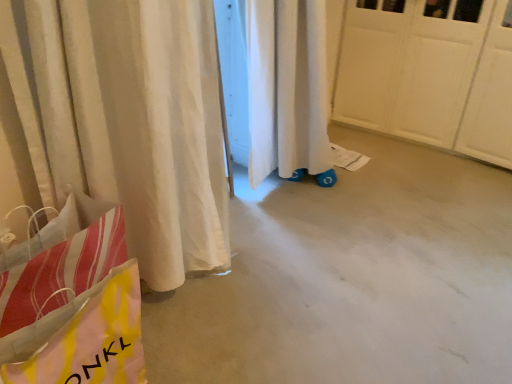
This screenshot has height=384, width=512. What do you see at coordinates (351, 279) in the screenshot?
I see `smooth concrete floor at center` at bounding box center [351, 279].

This screenshot has height=384, width=512. I want to click on smooth concrete floor at center, so (351, 279).

What is the approximate width of yellow and pink plastic bag at lower left?

yellow and pink plastic bag at lower left is 4.51 inches in width.

This screenshot has height=384, width=512. What are the coordinates of `yellow and pink plastic bag at lower left` in the screenshot? It's located at (93, 339).

Image resolution: width=512 pixels, height=384 pixels. What do you see at coordinates (93, 339) in the screenshot? I see `yellow and pink plastic bag at lower left` at bounding box center [93, 339].

Locate an element on the screen. The height and width of the screenshot is (384, 512). smooth concrete floor at center is located at coordinates (351, 279).

Which is more to the right, smooth concrete floor at center or yellow and pink plastic bag at lower left?

Positioned to the right is smooth concrete floor at center.

Is smooth concrete floor at center positioned behind yellow and pink plastic bag at lower left?

Yes, it is.

Is point (264, 227) closer or farther from the camera than point (65, 347)?

Point (264, 227).

From the image's perspective, is smooth concrete floor at center above or below yellow and pink plastic bag at lower left?

smooth concrete floor at center is above yellow and pink plastic bag at lower left.

From a real-world perspective, is smooth concrete floor at center located beneath yellow and pink plastic bag at lower left?

Yes, from a real-world perspective, smooth concrete floor at center is beneath yellow and pink plastic bag at lower left.

Looking at their sizes, would you say smooth concrete floor at center is wider or thinner than yellow and pink plastic bag at lower left?

Clearly, smooth concrete floor at center has more width compared to yellow and pink plastic bag at lower left.

Between smooth concrete floor at center and yellow and pink plastic bag at lower left, which one has less height?

Standing shorter between the two is smooth concrete floor at center.

Who is smaller, smooth concrete floor at center or yellow and pink plastic bag at lower left?

yellow and pink plastic bag at lower left is smaller.

Is smooth concrete floor at center positioned beyond the bounds of yellow and pink plastic bag at lower left?

That's correct, smooth concrete floor at center is outside of yellow and pink plastic bag at lower left.

Is the surface of smooth concrete floor at center in direct contact with yellow and pink plastic bag at lower left?

No, smooth concrete floor at center is not in contact with yellow and pink plastic bag at lower left.

Is smooth concrete floor at center facing away from yellow and pink plastic bag at lower left?

No.

How many degrees apart are the facing directions of smooth concrete floor at center and yellow and pink plastic bag at lower left?

The facing directions of smooth concrete floor at center and yellow and pink plastic bag at lower left are 88.6 degrees apart.

This screenshot has width=512, height=384. I want to click on concrete below the yellow and pink plastic bag at lower left (from a real-world perspective), so click(351, 279).

Does yellow and pink plastic bag at lower left appear on the right side of smooth concrete floor at center?

No.

Is yellow and pink plastic bag at lower left behind smooth concrete floor at center?

That is False.

Does point (7, 363) lie in front of point (162, 308)?

That is True.

From the image's perspective, between yellow and pink plastic bag at lower left and smooth concrete floor at center, who is located below?

yellow and pink plastic bag at lower left appears lower in the image.

From a real-world perspective, who is located lower, yellow and pink plastic bag at lower left or smooth concrete floor at center?

smooth concrete floor at center.

Between yellow and pink plastic bag at lower left and smooth concrete floor at center, which one has smaller width?

yellow and pink plastic bag at lower left is thinner.

Is yellow and pink plastic bag at lower left taller or shorter than smooth concrete floor at center?

Clearly, yellow and pink plastic bag at lower left is taller compared to smooth concrete floor at center.

Between yellow and pink plastic bag at lower left and smooth concrete floor at center, which one has larger size?

smooth concrete floor at center.

Is yellow and pink plastic bag at lower left completely or partially outside of smooth concrete floor at center?

Yes, yellow and pink plastic bag at lower left is outside of smooth concrete floor at center.

Is yellow and pink plastic bag at lower left next to smooth concrete floor at center?

There is a gap between yellow and pink plastic bag at lower left and smooth concrete floor at center.

Is yellow and pink plastic bag at lower left facing towards smooth concrete floor at center?

No, yellow and pink plastic bag at lower left is not facing towards smooth concrete floor at center.

How different are the orientations of yellow and pink plastic bag at lower left and smooth concrete floor at center in degrees?

They differ by 88.6 degrees in their facing directions.

Locate an element on the screen. concrete on the right of yellow and pink plastic bag at lower left is located at coordinates (351, 279).

The height and width of the screenshot is (384, 512). Find the location of `grocery bag in front of the smooth concrete floor at center`. grocery bag in front of the smooth concrete floor at center is located at coordinates (93, 339).

The image size is (512, 384). Identify the location of concrete on the right of yellow and pink plastic bag at lower left. (351, 279).